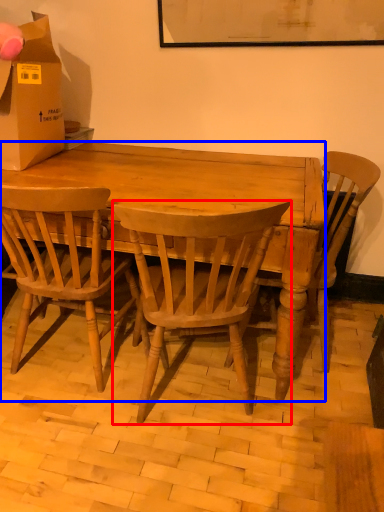
Question: Which object appears farthest to the camera in this image, chair (highlighted by a red box) or desk (highlighted by a blue box)?

Choices:
 (A) chair
 (B) desk

Answer: (B)